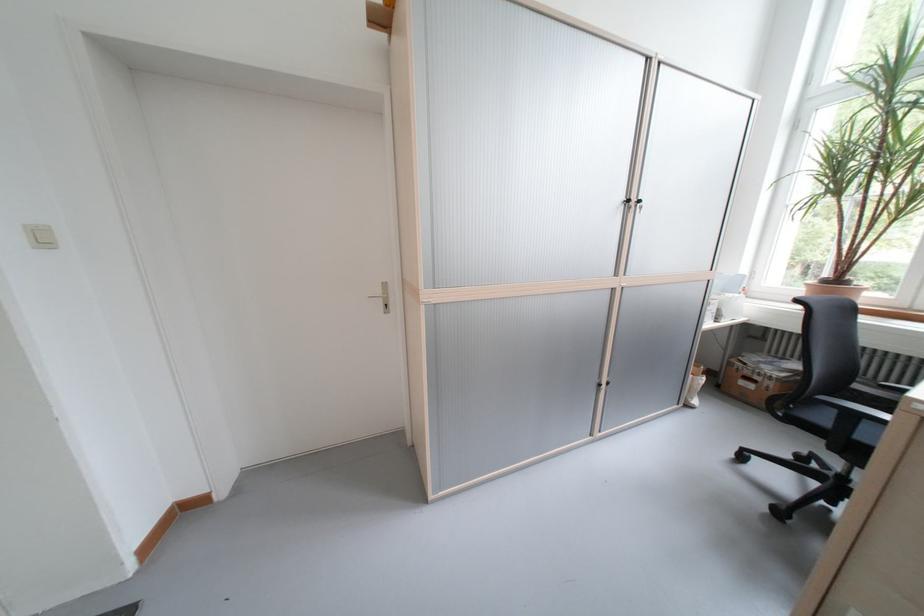
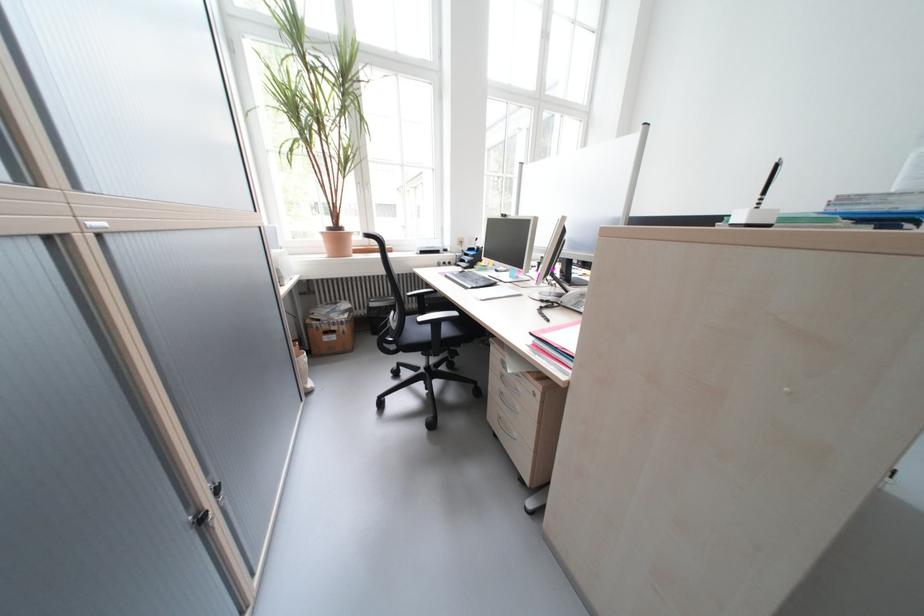
In the second image, find the point that corresponds to point 761,387 in the first image.

(344, 339)